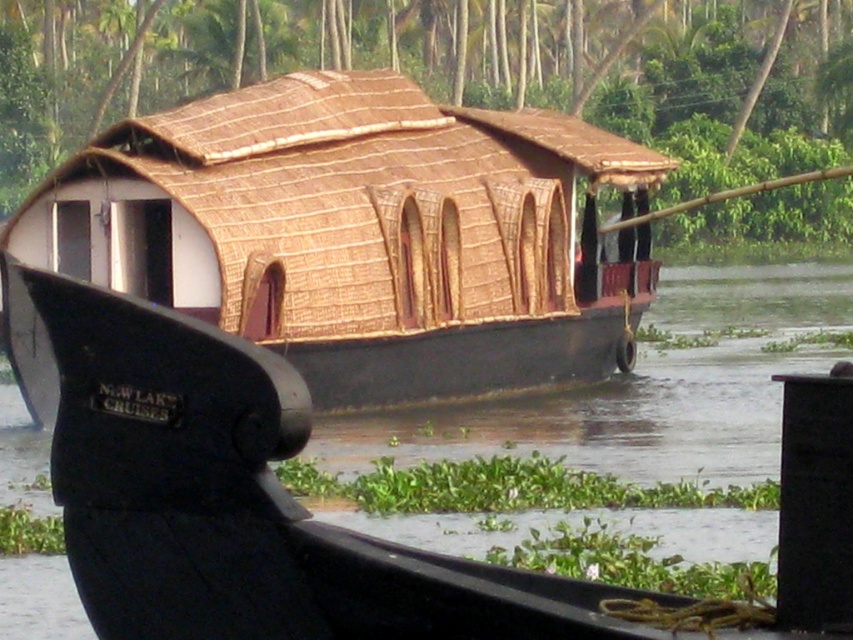
Consider the image. Which of these two, brown thatched roof houseboat at center or brown thatch roof at center, stands shorter?

With less height is brown thatched roof houseboat at center.

Who is positioned more to the left, brown thatched roof houseboat at center or brown thatch roof at center?

Positioned to the left is brown thatched roof houseboat at center.

The width and height of the screenshot is (853, 640). I want to click on brown thatched roof houseboat at center, so click(x=352, y=237).